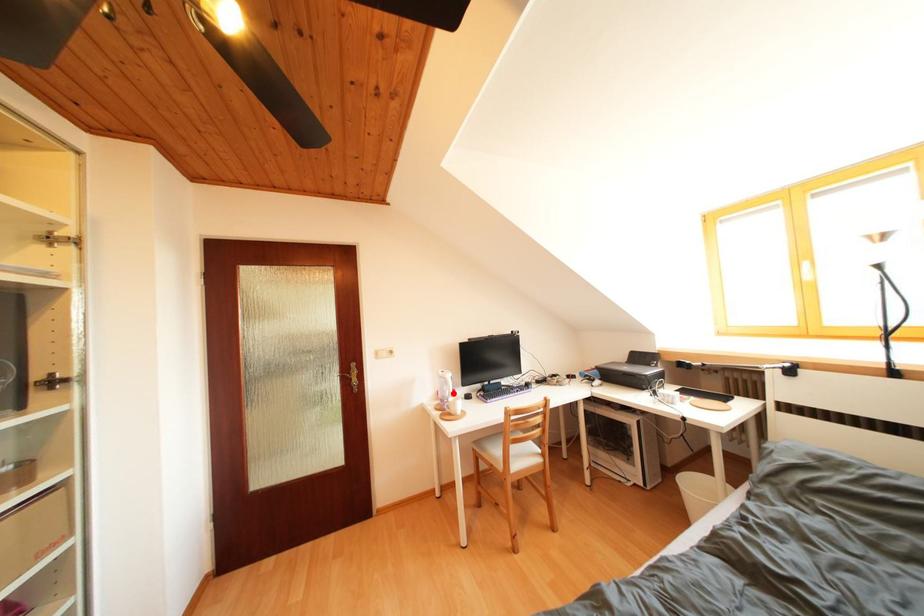
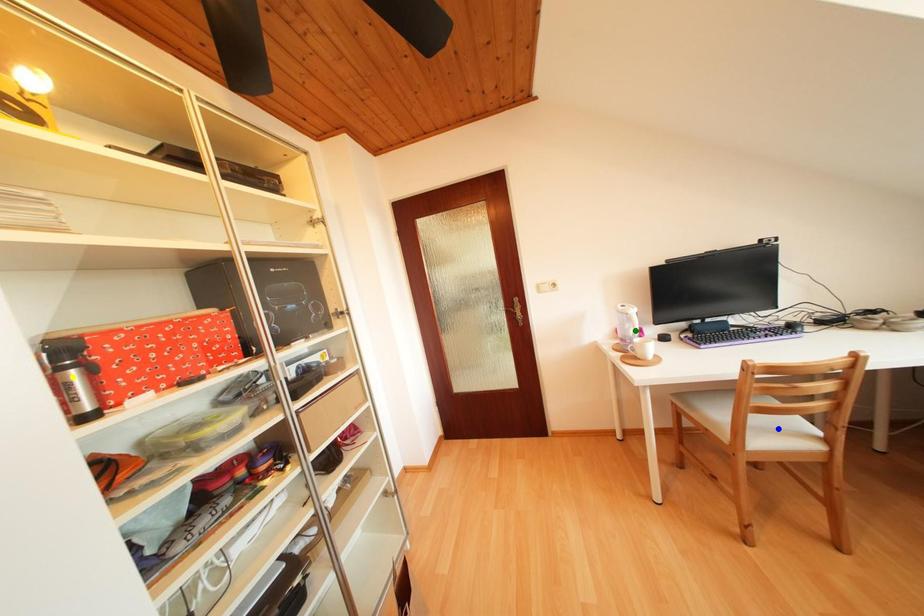
Question: I am providing you with two images of the same scene from different viewpoints. A red point is marked on the first image. You are given multiple points on the second image. Which spot in image 2 lines up with the point in image 1?

Choices:
 (A) yellow point
 (B) blue point
 (C) green point

Answer: (C)